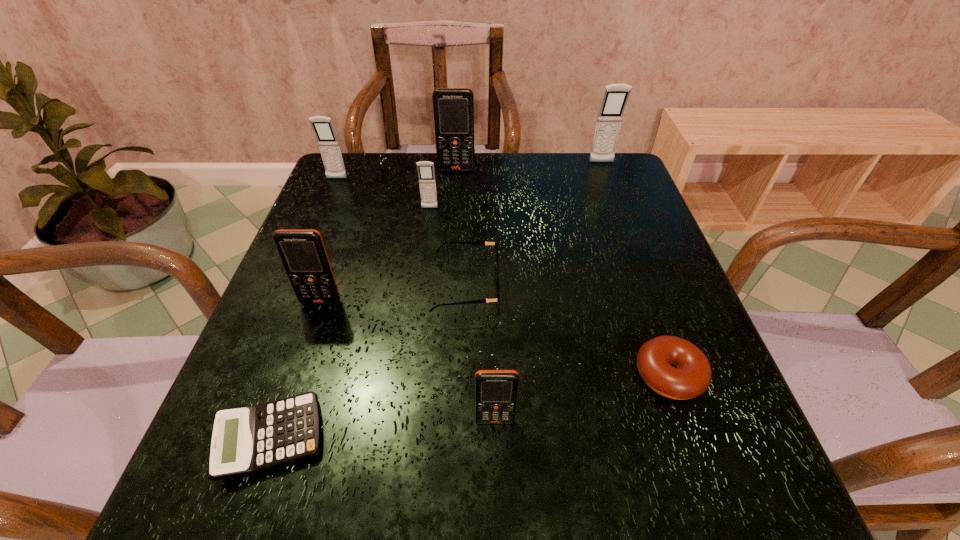
Where is `object that is positioned at the far right corner`? This screenshot has width=960, height=540. object that is positioned at the far right corner is located at coordinates (615, 97).

Locate an element on the screen. free space at the far edge is located at coordinates (528, 179).

In the image, there is a desktop. Where is `vacant space at the near edge`? This screenshot has width=960, height=540. vacant space at the near edge is located at coordinates (380, 505).

This screenshot has height=540, width=960. Identify the location of vacant space at the left edge. (365, 224).

I want to click on vacant region at the right edge of the desktop, so click(726, 421).

In the image, there is a desktop. At what (x,y) coordinates should I click in order to perform the action: click on vacant space at the far left corner. Please return your answer as a coordinate pair (x, y). Looking at the image, I should click on (387, 166).

In the image, there is a desktop. At what (x,y) coordinates should I click in order to perform the action: click on vacant region at the near left corner. Please return your answer as a coordinate pair (x, y). The image size is (960, 540). Looking at the image, I should click on (295, 467).

At what (x,y) coordinates should I click in order to perform the action: click on vacant space at the far right corner. Please return your answer as a coordinate pair (x, y). The height and width of the screenshot is (540, 960). Looking at the image, I should click on (573, 163).

Where is `vacant space that is in between the calculator and the chocolate doughnut`? The height and width of the screenshot is (540, 960). vacant space that is in between the calculator and the chocolate doughnut is located at coordinates (469, 407).

This screenshot has width=960, height=540. Find the location of `free space between the rightmost orange cellular telephone and the biggest orange cellular telephone`. free space between the rightmost orange cellular telephone and the biggest orange cellular telephone is located at coordinates (476, 295).